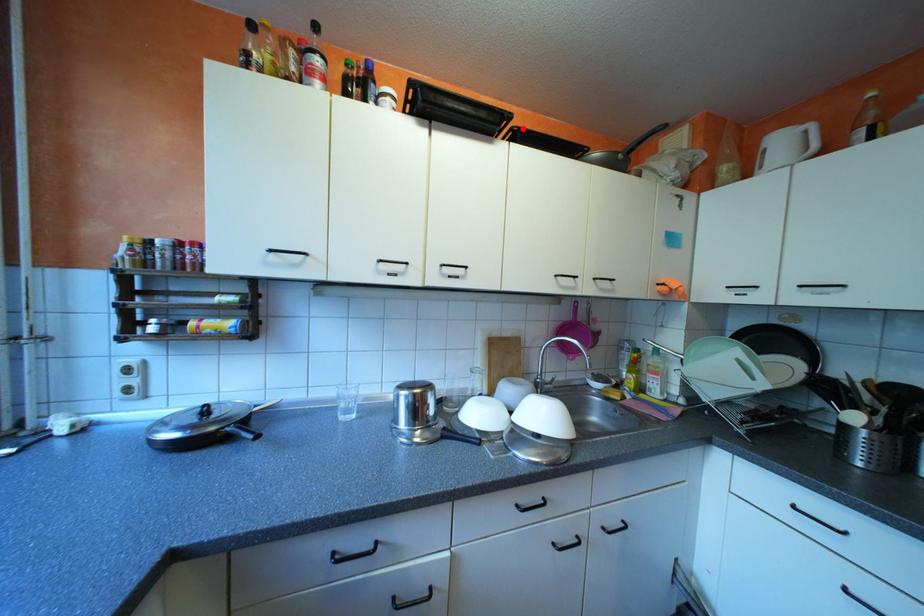
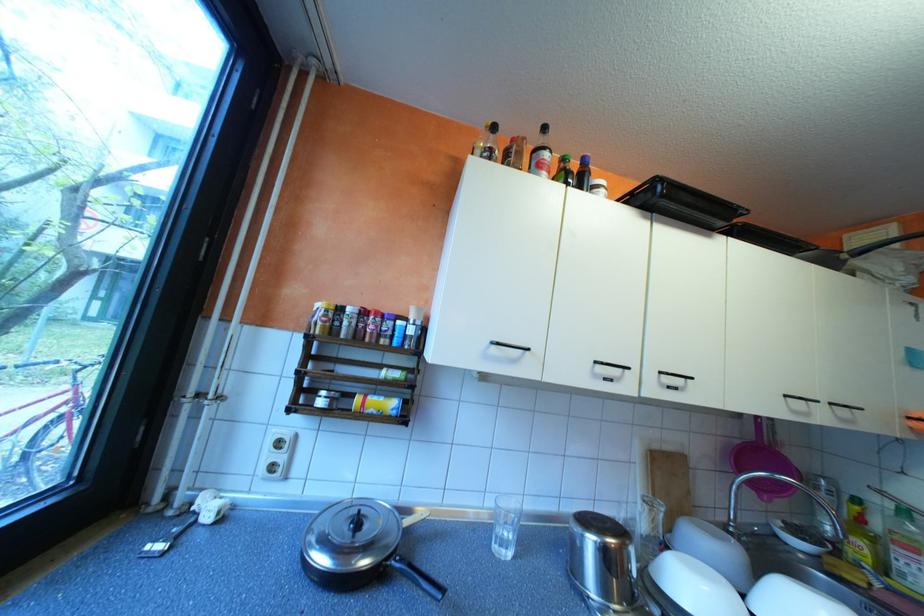
Question: I am providing you with two images of the same scene from different viewpoints. A red point is marked on the first image. Is the red point's position out of view in image 2?

Choices:
 (A) Yes
 (B) No

Answer: (B)